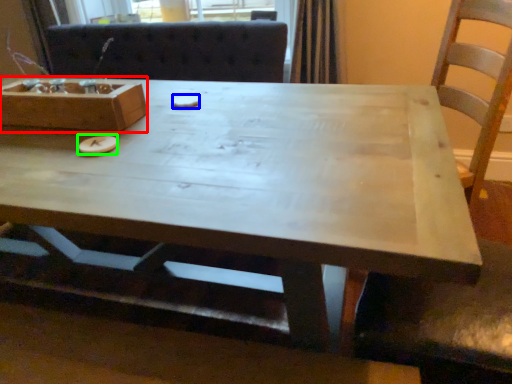
Question: Considering the real-world distances, which object is farthest from box (highlighted by a red box)? food (highlighted by a blue box) or food (highlighted by a green box)?

Choices:
 (A) food
 (B) food

Answer: (A)